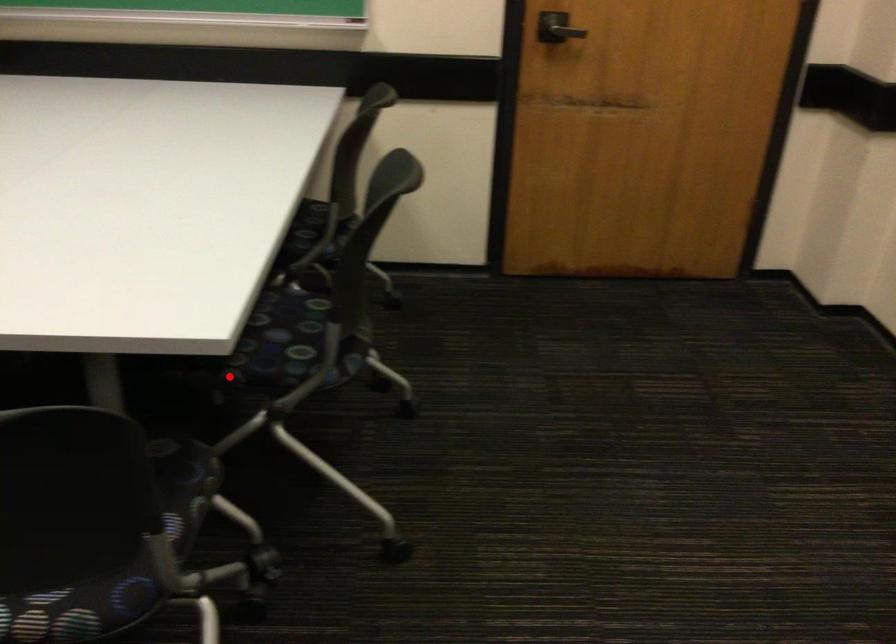
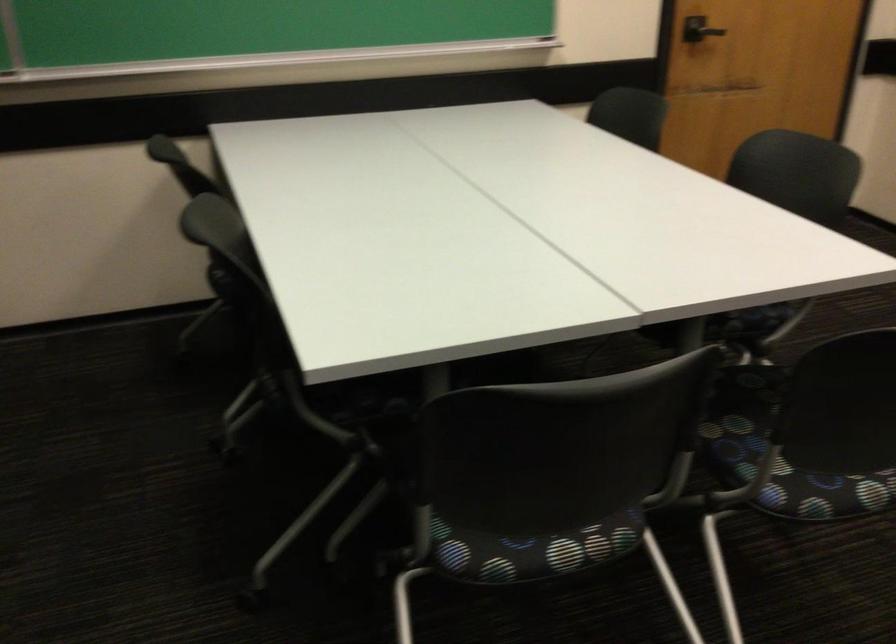
In the second image, find the point that corresponds to the highlighted location in the first image.

(734, 328)